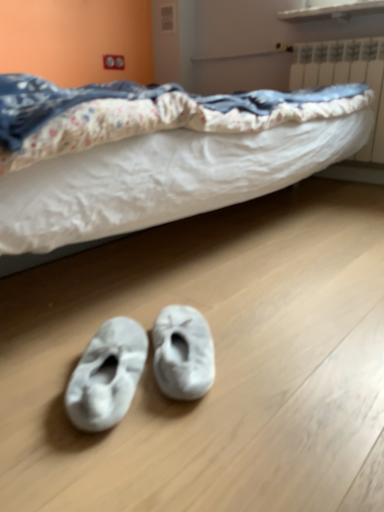
Question: Is white fuzzy slippers at lower center, which is the second footwear from right to left, beside white plastic radiator at upper right?

Choices:
 (A) no
 (B) yes

Answer: (A)

Question: Would you say white plastic radiator at upper right is part of white fuzzy slippers at lower center, the 1th footwear positioned from the left,'s contents?

Choices:
 (A) yes
 (B) no

Answer: (B)

Question: Is white fuzzy slippers at lower center, the 1th footwear positioned from the left, not within white plastic radiator at upper right?

Choices:
 (A) yes
 (B) no

Answer: (A)

Question: Would you consider white fuzzy slippers at lower center, which is the second footwear from right to left, to be distant from white plastic radiator at upper right?

Choices:
 (A) yes
 (B) no

Answer: (A)

Question: Does white fuzzy slippers at lower center, the 1th footwear positioned from the left, turn towards white plastic radiator at upper right?

Choices:
 (A) no
 (B) yes

Answer: (A)

Question: Can you confirm if white fuzzy slippers at lower center, which is the second footwear from right to left, is taller than white plastic radiator at upper right?

Choices:
 (A) yes
 (B) no

Answer: (B)

Question: Does white fuzzy slippers at lower center, which is the second footwear from right to left, contain white fuzzy slippers at lower center, the second footwear viewed from the left?

Choices:
 (A) yes
 (B) no

Answer: (B)

Question: Is white fuzzy slippers at lower center, which is the second footwear from right to left, next to white fuzzy slippers at lower center, the 1th footwear viewed from the right, and touching it?

Choices:
 (A) no
 (B) yes

Answer: (B)

Question: Considering the relative positions of white fuzzy slippers at lower center, which is the second footwear from right to left, and white fuzzy slippers at lower center, the second footwear viewed from the left, in the image provided, is white fuzzy slippers at lower center, which is the second footwear from right to left, to the right of white fuzzy slippers at lower center, the second footwear viewed from the left, from the viewer's perspective?

Choices:
 (A) yes
 (B) no

Answer: (B)

Question: Is white fuzzy slippers at lower center, the 1th footwear positioned from the left, further to camera compared to white fuzzy slippers at lower center, the second footwear viewed from the left?

Choices:
 (A) no
 (B) yes

Answer: (A)

Question: Does white fuzzy slippers at lower center, which is the second footwear from right to left, have a larger size compared to white fuzzy slippers at lower center, the 1th footwear viewed from the right?

Choices:
 (A) yes
 (B) no

Answer: (A)

Question: Is white fuzzy slippers at lower center, which is the second footwear from right to left, outside of white fuzzy slippers at lower center, the 1th footwear viewed from the right?

Choices:
 (A) no
 (B) yes

Answer: (B)

Question: Is white fuzzy slippers at lower center, the second footwear viewed from the left, looking in the opposite direction of white plastic radiator at upper right?

Choices:
 (A) yes
 (B) no

Answer: (B)